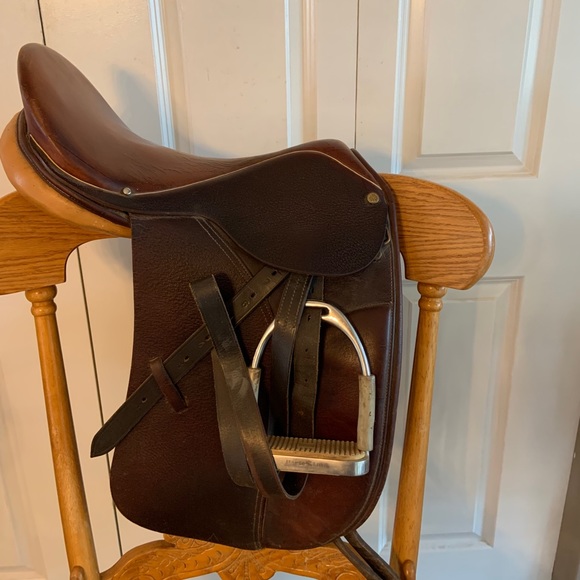
Where is `doors`? doors is located at coordinates (431, 83), (258, 106).